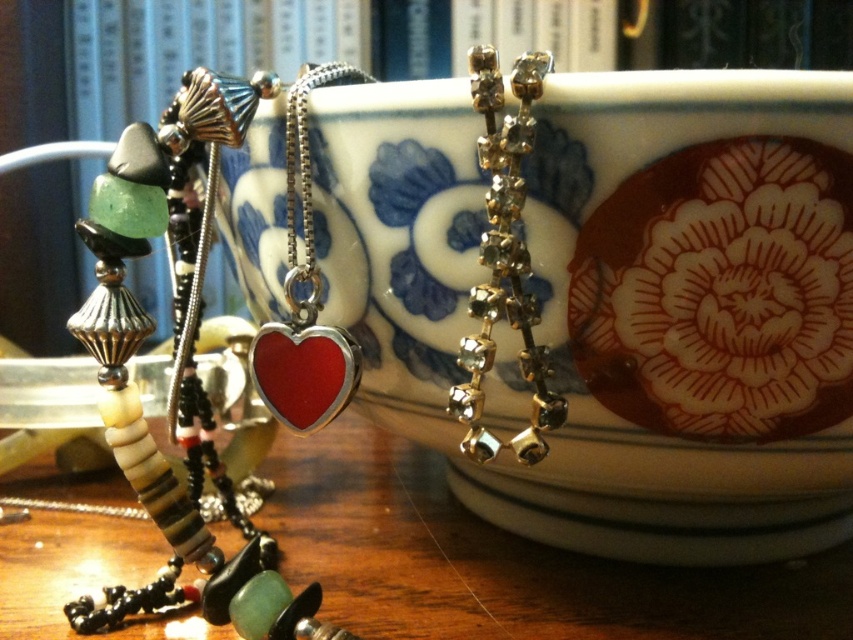
You are a jeweler examining the display. You need to determine which of the two items, the shiny red heart pendant at center or the clear crystal earrings at upper center, is taller. Which one is taller?

The shiny red heart pendant at center is taller than the clear crystal earrings at upper center.

Based on the scene description, where is the shiny red heart pendant at center located in terms of its 2D coordinates?

The shiny red heart pendant at center is located at the 2D coordinates of point (173, 353).